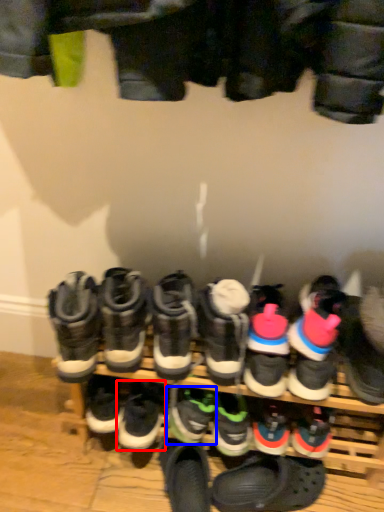
Question: Which object is closer to the camera taking this photo, footwear (highlighted by a red box) or footwear (highlighted by a blue box)?

Choices:
 (A) footwear
 (B) footwear

Answer: (B)